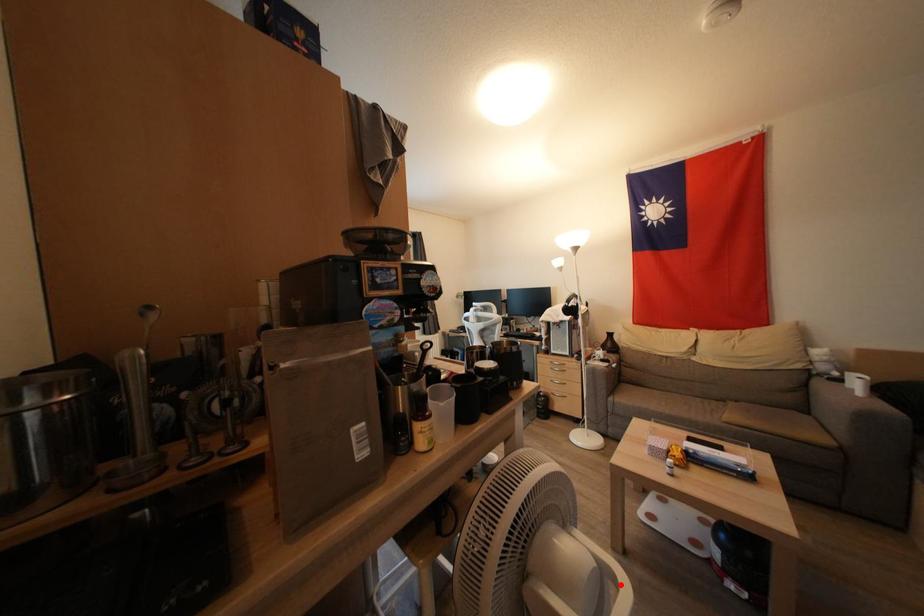
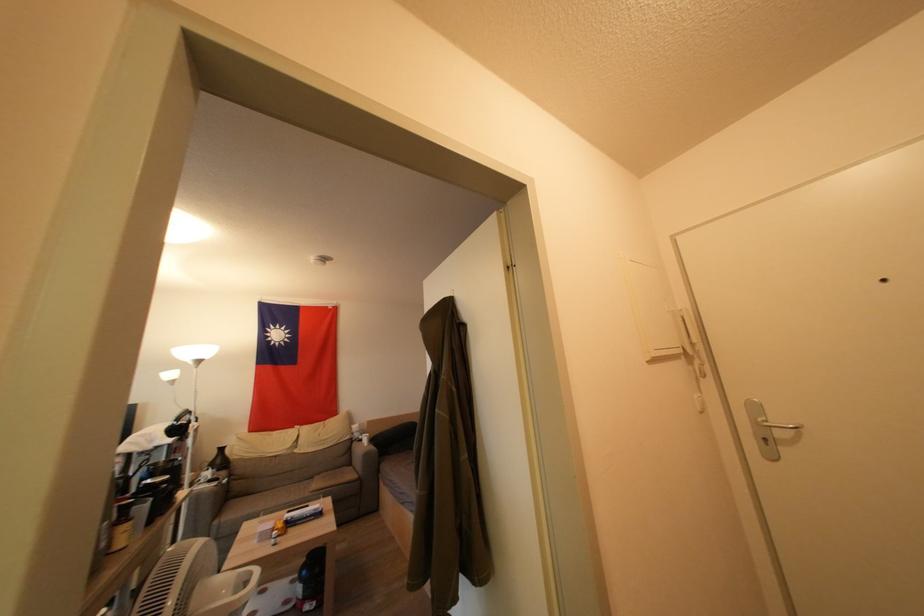
Find the pixel in the second image that matches the highlighted location in the first image.

(256, 577)